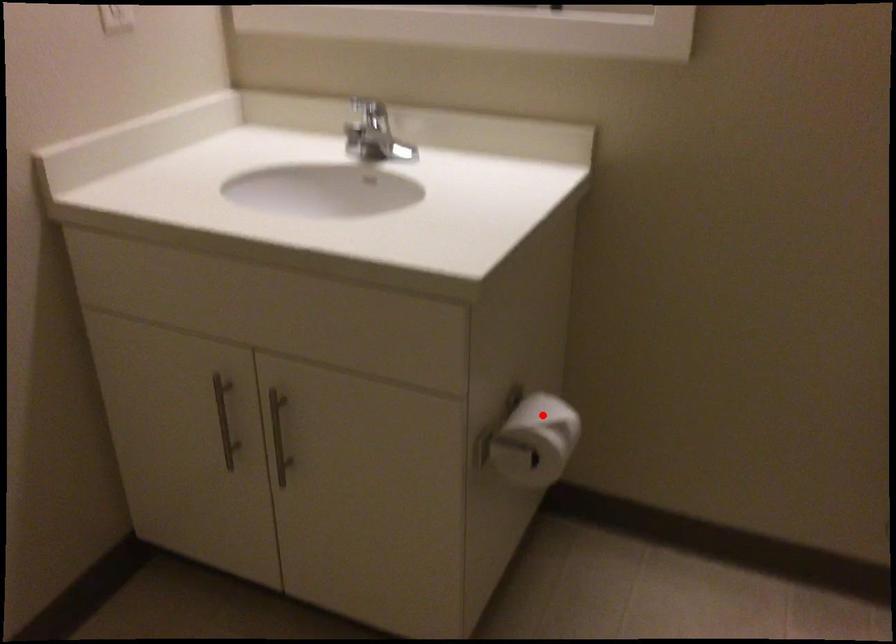
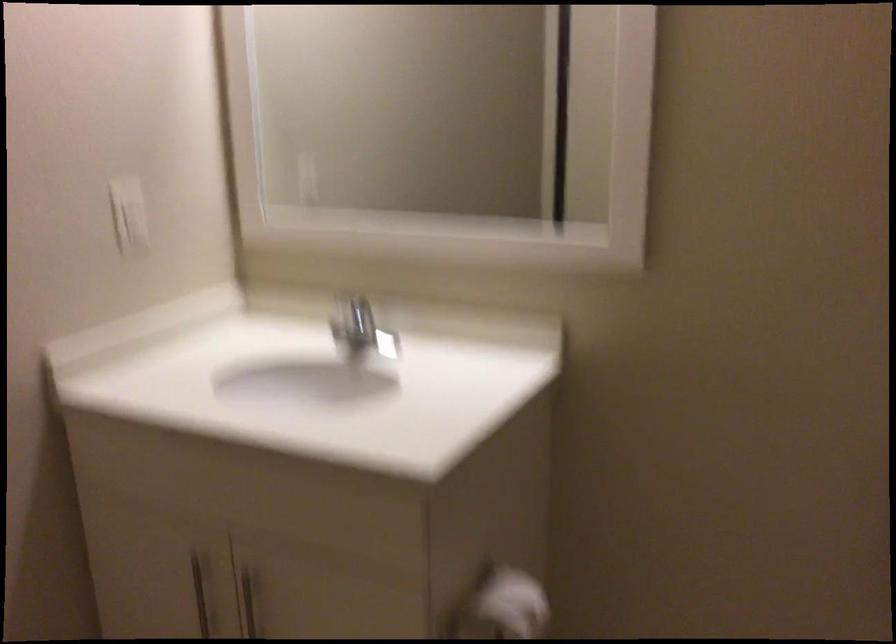
Find the pixel in the second image that matches the highlighted location in the first image.

(511, 603)